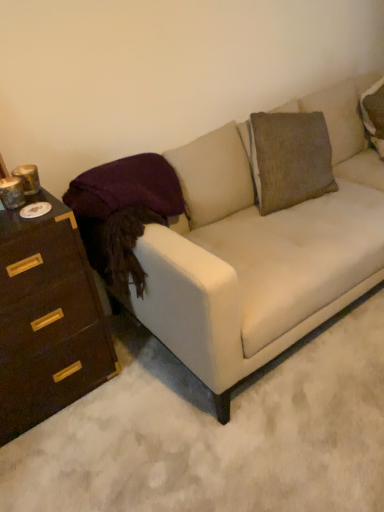
Question: Does dark brown wood chest of drawers at left have a smaller size compared to white fabric couch at center?

Choices:
 (A) no
 (B) yes

Answer: (B)

Question: Does dark brown wood chest of drawers at left have a greater width compared to white fabric couch at center?

Choices:
 (A) yes
 (B) no

Answer: (B)

Question: Considering the relative sizes of dark brown wood chest of drawers at left and white fabric couch at center in the image provided, is dark brown wood chest of drawers at left taller than white fabric couch at center?

Choices:
 (A) no
 (B) yes

Answer: (A)

Question: Does dark brown wood chest of drawers at left lie in front of white fabric couch at center?

Choices:
 (A) no
 (B) yes

Answer: (A)

Question: Is dark brown wood chest of drawers at left positioned behind white fabric couch at center?

Choices:
 (A) no
 (B) yes

Answer: (B)

Question: From the image's perspective, is dark brown wood chest of drawers at left on white fabric couch at center?

Choices:
 (A) yes
 (B) no

Answer: (B)

Question: Is the position of white fabric couch at center more distant than that of dark brown wood chest of drawers at left?

Choices:
 (A) no
 (B) yes

Answer: (A)

Question: Is white fabric couch at center in front of dark brown wood chest of drawers at left?

Choices:
 (A) yes
 (B) no

Answer: (A)

Question: From the image's perspective, does white fabric couch at center appear higher than dark brown wood chest of drawers at left?

Choices:
 (A) yes
 (B) no

Answer: (A)

Question: Considering the relative sizes of white fabric couch at center and dark brown wood chest of drawers at left in the image provided, is white fabric couch at center wider than dark brown wood chest of drawers at left?

Choices:
 (A) yes
 (B) no

Answer: (A)

Question: Is white fabric couch at center oriented towards dark brown wood chest of drawers at left?

Choices:
 (A) yes
 (B) no

Answer: (B)

Question: Considering the relative positions of white fabric couch at center and dark brown wood chest of drawers at left in the image provided, is white fabric couch at center to the left of dark brown wood chest of drawers at left from the viewer's perspective?

Choices:
 (A) yes
 (B) no

Answer: (B)

Question: Is point (11, 278) positioned closer to the camera than point (274, 268)?

Choices:
 (A) farther
 (B) closer

Answer: (B)